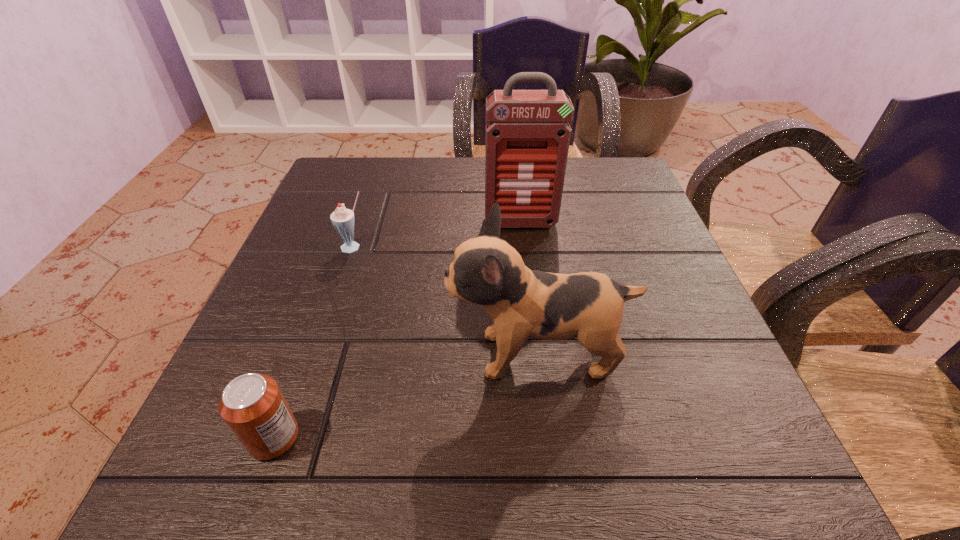
At what (x,y) coordinates should I click in order to perform the action: click on vacant space located on the straw side of the third nearest object. Please return your answer as a coordinate pair (x, y). Image resolution: width=960 pixels, height=540 pixels. Looking at the image, I should click on (342, 286).

Locate an element on the screen. The height and width of the screenshot is (540, 960). vacant space situated on the right of the nearest object is located at coordinates (417, 437).

What are the coordinates of `object that is at the near edge` in the screenshot? It's located at (252, 405).

The image size is (960, 540). Find the location of `milkshake that is at the left edge`. milkshake that is at the left edge is located at coordinates (342, 219).

The width and height of the screenshot is (960, 540). In order to click on can at the left edge in this screenshot , I will do `click(252, 405)`.

This screenshot has width=960, height=540. I want to click on object situated at the right edge, so click(x=487, y=271).

The height and width of the screenshot is (540, 960). In order to click on object that is at the near left corner in this screenshot , I will do `click(252, 405)`.

In the image, there is a desktop. Where is `free space at the far edge`? The height and width of the screenshot is (540, 960). free space at the far edge is located at coordinates (463, 185).

This screenshot has height=540, width=960. In the image, there is a desktop. What are the coordinates of `vacant space at the near edge` in the screenshot? It's located at (612, 463).

Locate an element on the screen. free space at the left edge of the desktop is located at coordinates (349, 263).